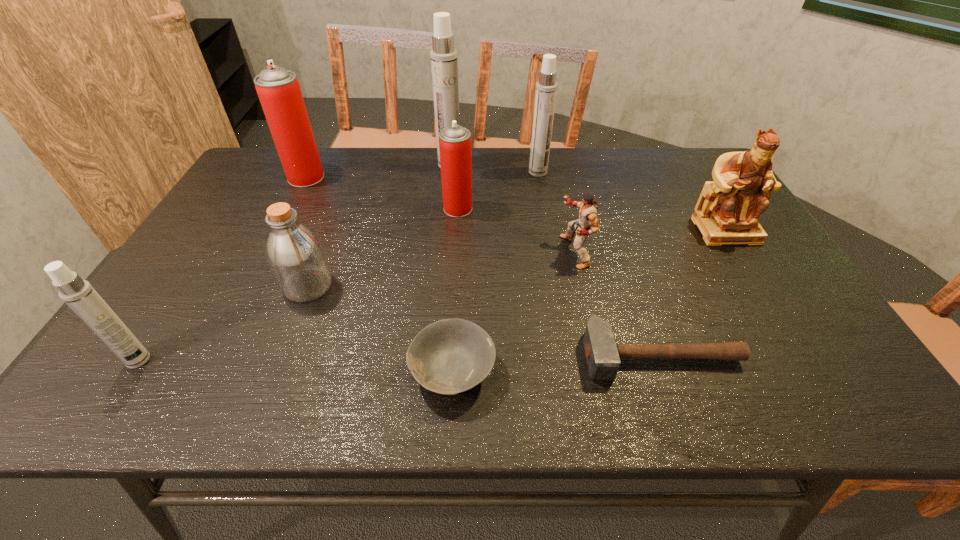
This screenshot has height=540, width=960. Identify the location of vacant point located between the bottle and the figurine. (516, 258).

Identify the location of free spot between the left red aerosol can and the leftmost aerosol can. The height and width of the screenshot is (540, 960). (223, 268).

This screenshot has height=540, width=960. Find the location of `vacant space in between the figurine and the bowl`. vacant space in between the figurine and the bowl is located at coordinates (588, 301).

Find the location of a particular element. vacant area between the bowl and the biggest white aerosol can is located at coordinates (451, 268).

You are a GUI agent. You are given a task and a screenshot of the screen. Output one action in this format:
    pyautogui.click(x=<x>, y=<y>)
    Task: Click on the vacant space that's between the hammer and the rightmost white aerosol can
    The width and height of the screenshot is (960, 540).
    Given the screenshot: What is the action you would take?
    pyautogui.click(x=599, y=264)

Where is `free spot between the leftmost object and the rightmost object`? The image size is (960, 540). free spot between the leftmost object and the rightmost object is located at coordinates (432, 295).

Identify the location of object that is the sixth closest to the rightmost white aerosol can. (449, 356).

Identify which object is the sixth nearest to the bowl. Please provide its 2D coordinates. Your answer should be formatted as a tuple, i.e. [(x, y)], where the tuple contains the x and y coordinates of a point satisfying the conditions above.

[(726, 213)]

Select which aerosol can is the closest to the hammer. Please provide its 2D coordinates. Your answer should be formatted as a tuple, i.e. [(x, y)], where the tuple contains the x and y coordinates of a point satisfying the conditions above.

[(455, 148)]

Select which aerosol can appears as the fifth closest to the figurine. Please provide its 2D coordinates. Your answer should be formatted as a tuple, i.e. [(x, y)], where the tuple contains the x and y coordinates of a point satisfying the conditions above.

[(79, 295)]